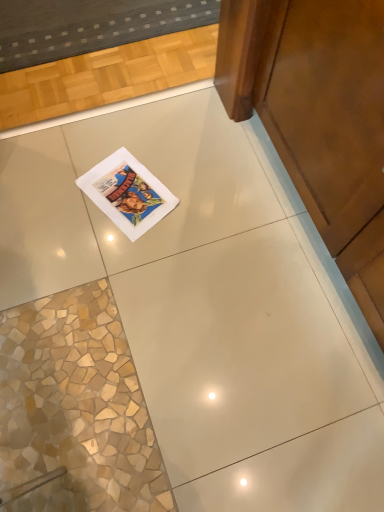
Where is `unoccupied area in front of matte paper magazine at center`? unoccupied area in front of matte paper magazine at center is located at coordinates (121, 257).